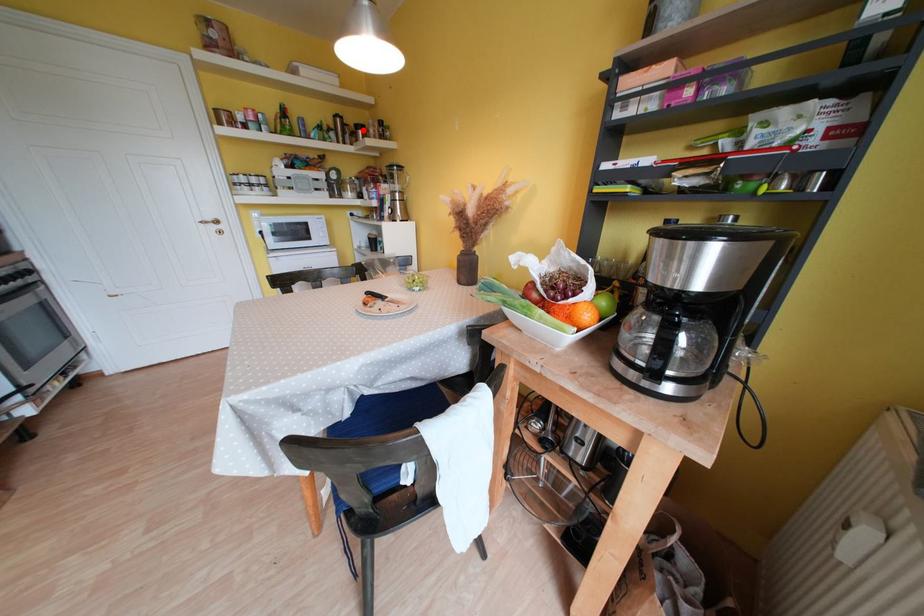
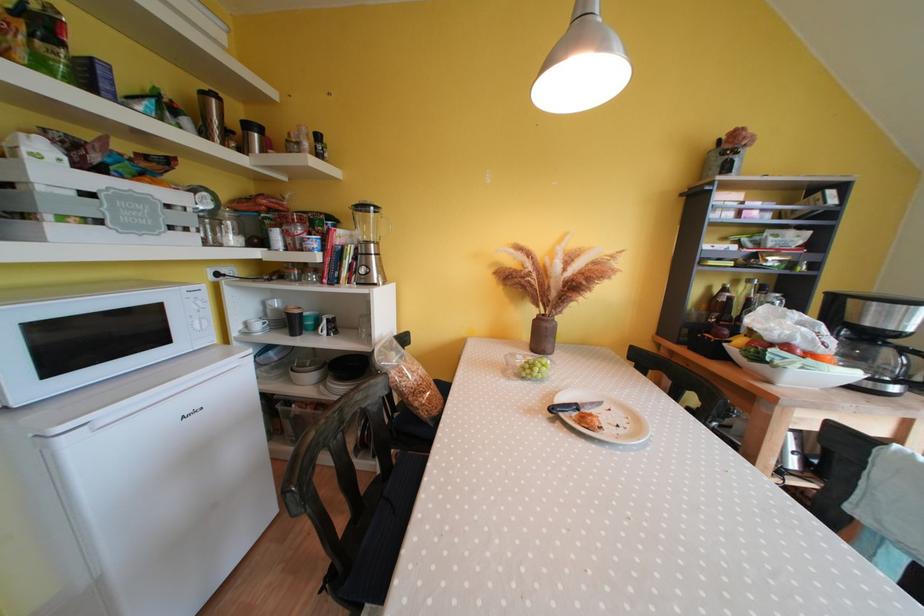
Locate, in the second image, the point that corresponds to the highlighted location in the first image.

(252, 130)